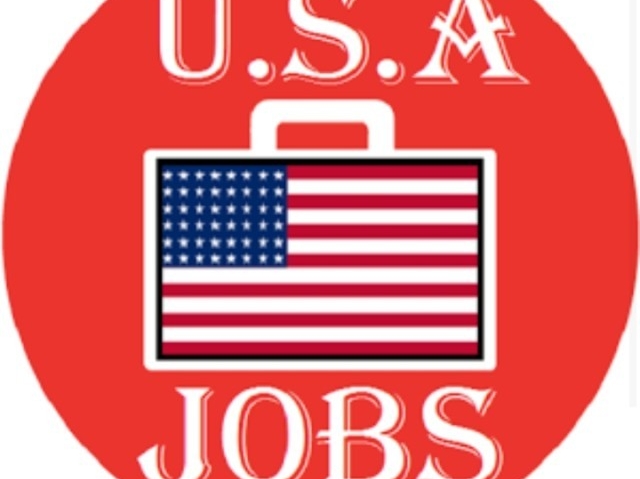
This screenshot has height=479, width=640. I want to click on handle, so click(320, 105).